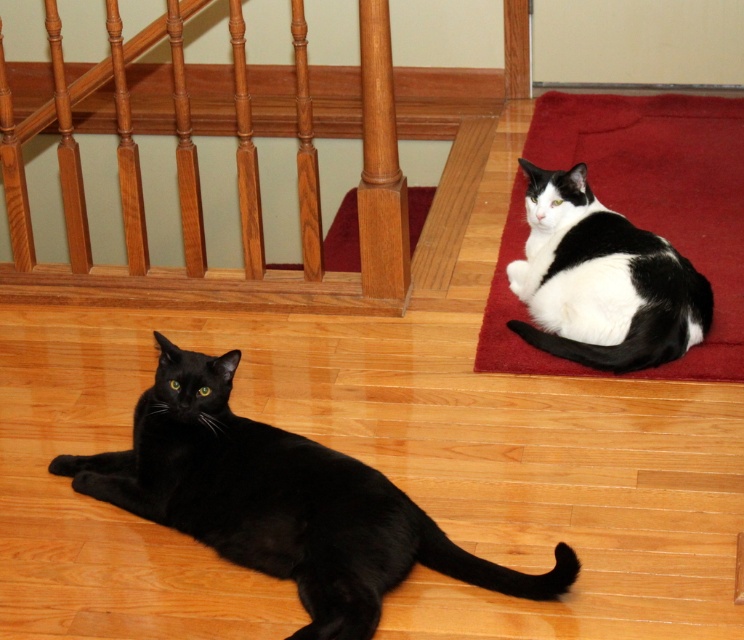
Question: Among these objects, which one is nearest to the camera?

Choices:
 (A) black glossy cat at left
 (B) black and white fur cat at upper right

Answer: (A)

Question: Which object is positioned farthest from the wooden balustrade at upper left?

Choices:
 (A) black glossy cat at left
 (B) black and white fur cat at upper right

Answer: (A)

Question: Does wooden balustrade at upper left have a lesser width compared to black glossy cat at left?

Choices:
 (A) yes
 (B) no

Answer: (B)

Question: Can you confirm if wooden balustrade at upper left is positioned to the right of black glossy cat at left?

Choices:
 (A) yes
 (B) no

Answer: (B)

Question: Can you confirm if black glossy cat at left is wider than black and white fur cat at upper right?

Choices:
 (A) yes
 (B) no

Answer: (A)

Question: Which point appears closest to the camera in this image?

Choices:
 (A) (19, 180)
 (B) (634, 352)

Answer: (B)